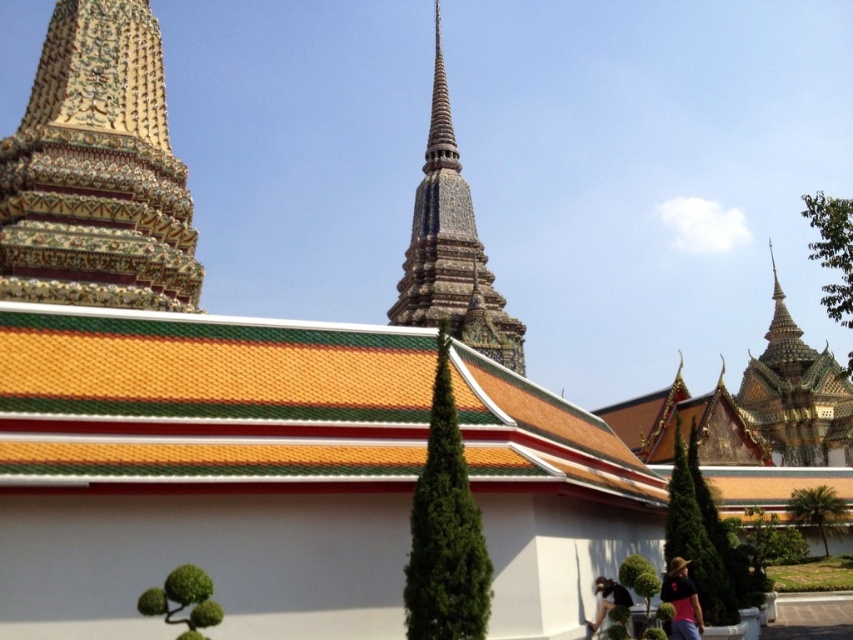
Question: Does gold textured stupa at upper right appear under black fabric at lower right?

Choices:
 (A) yes
 (B) no

Answer: (B)

Question: Which of these objects is positioned farthest from the pink fabric at lower right?

Choices:
 (A) gold textured stupa at upper right
 (B) polished stone spire at center
 (C) black fabric at lower right

Answer: (A)

Question: Which object is farther from the camera taking this photo?

Choices:
 (A) golden mosaic temple at upper left
 (B) black fabric at lower right
 (C) pink fabric at lower right
 (D) polished stone spire at center

Answer: (D)

Question: Can you confirm if pink fabric at lower right is positioned below black fabric at lower right?

Choices:
 (A) yes
 (B) no

Answer: (B)

Question: Which of these objects is positioned closest to the pink fabric at lower right?

Choices:
 (A) black fabric at lower right
 (B) golden mosaic temple at upper left
 (C) gold textured stupa at upper right

Answer: (A)

Question: Can you confirm if gold textured stupa at upper right is smaller than black fabric at lower right?

Choices:
 (A) no
 (B) yes

Answer: (A)